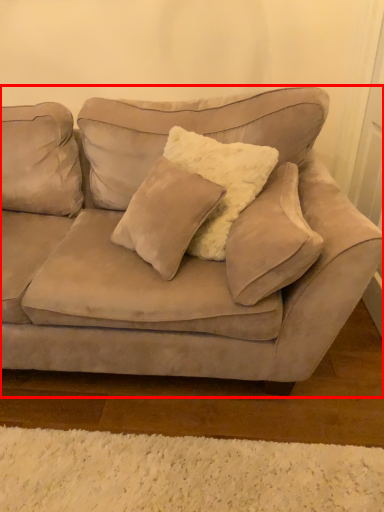
Question: Considering the relative positions of studio couch (annotated by the red box) and pillow in the image provided, where is studio couch (annotated by the red box) located with respect to the staircase?

Choices:
 (A) left
 (B) right

Answer: (A)